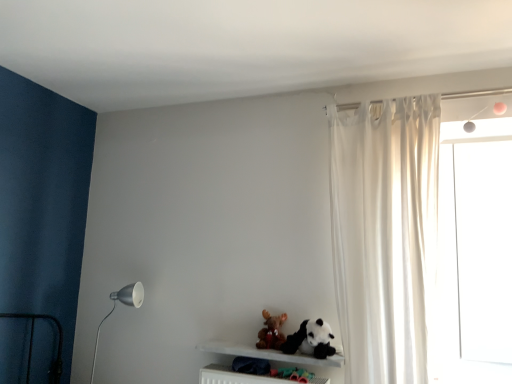
Question: Which direction should I rotate to look at black plush panda at lower center, positioned as the 2th toy in left-to-right order?

Choices:
 (A) right
 (B) left

Answer: (A)

Question: Is black plush panda at lower center, positioned as the 2th toy in left-to-right order, aimed at white sheer curtain at right?

Choices:
 (A) no
 (B) yes

Answer: (A)

Question: Is black plush panda at lower center, positioned as the 2th toy in left-to-right order, smaller than white sheer curtain at right?

Choices:
 (A) yes
 (B) no

Answer: (A)

Question: Does black plush panda at lower center, the 1th toy from the right, come behind white sheer curtain at right?

Choices:
 (A) yes
 (B) no

Answer: (A)

Question: From the image's perspective, is black plush panda at lower center, the 1th toy from the right, under white sheer curtain at right?

Choices:
 (A) no
 (B) yes

Answer: (B)

Question: Considering the relative sizes of black plush panda at lower center, the 1th toy from the right, and white sheer curtain at right in the image provided, is black plush panda at lower center, the 1th toy from the right, taller than white sheer curtain at right?

Choices:
 (A) no
 (B) yes

Answer: (A)

Question: Does black plush panda at lower center, positioned as the 2th toy in left-to-right order, appear on the left side of white sheer curtain at right?

Choices:
 (A) yes
 (B) no

Answer: (A)

Question: Is black plush panda at lower center, positioned as the 2th toy in left-to-right order, to the left of matte white metal floor lamp at left from the viewer's perspective?

Choices:
 (A) no
 (B) yes

Answer: (A)

Question: Does black plush panda at lower center, the 1th toy from the right, have a lesser width compared to matte white metal floor lamp at left?

Choices:
 (A) no
 (B) yes

Answer: (A)

Question: Would you say black plush panda at lower center, positioned as the 2th toy in left-to-right order, contains matte white metal floor lamp at left?

Choices:
 (A) yes
 (B) no

Answer: (B)

Question: From the image's perspective, is black plush panda at lower center, the 1th toy from the right, beneath matte white metal floor lamp at left?

Choices:
 (A) yes
 (B) no

Answer: (B)

Question: Is black plush panda at lower center, the 1th toy from the right, not near matte white metal floor lamp at left?

Choices:
 (A) yes
 (B) no

Answer: (A)

Question: Is black plush panda at lower center, positioned as the 2th toy in left-to-right order, with matte white metal floor lamp at left?

Choices:
 (A) yes
 (B) no

Answer: (B)

Question: Could white matte shelf at lower center be considered to be inside matte white metal floor lamp at left?

Choices:
 (A) no
 (B) yes

Answer: (A)